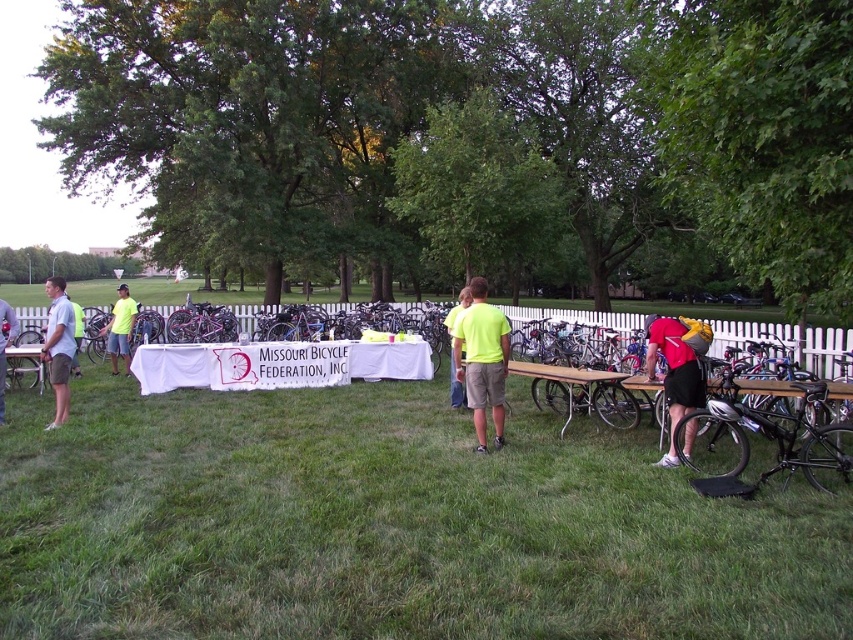
Question: Does light gray shirt at left have a greater width compared to neon yellow t-shirt at left?

Choices:
 (A) no
 (B) yes

Answer: (B)

Question: Is neon yellow t-shirt at left to the left of light green t-shirt at left from the viewer's perspective?

Choices:
 (A) no
 (B) yes

Answer: (A)

Question: Among these points, which one is farthest from the camera?

Choices:
 (A) (71, 618)
 (B) (683, 348)

Answer: (B)

Question: Which point is closer to the camera?

Choices:
 (A) (74, 374)
 (B) (111, 371)

Answer: (A)

Question: Which point is closer to the camera taking this photo?

Choices:
 (A) (120, 344)
 (B) (3, 413)

Answer: (B)

Question: In this image, where is light gray shorts at center located relative to light green t-shirt at left?

Choices:
 (A) below
 (B) above

Answer: (A)